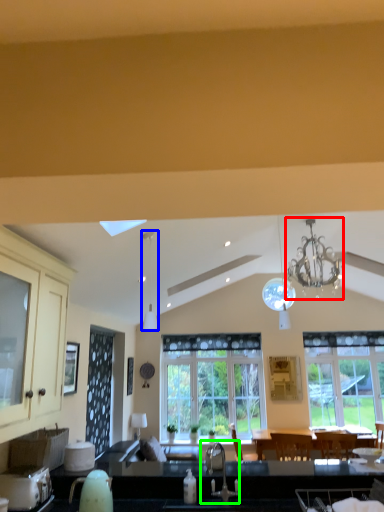
Question: Which object is the closest to the light fixture (highlighted by a red box)? Choose among these: light fixture (highlighted by a blue box) or sink (highlighted by a green box).

Choices:
 (A) light fixture
 (B) sink

Answer: (B)